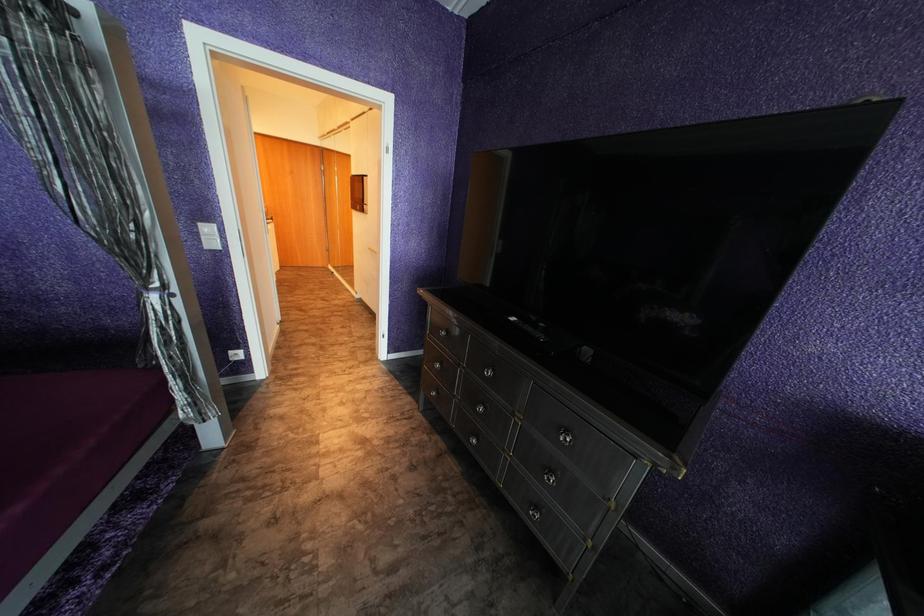
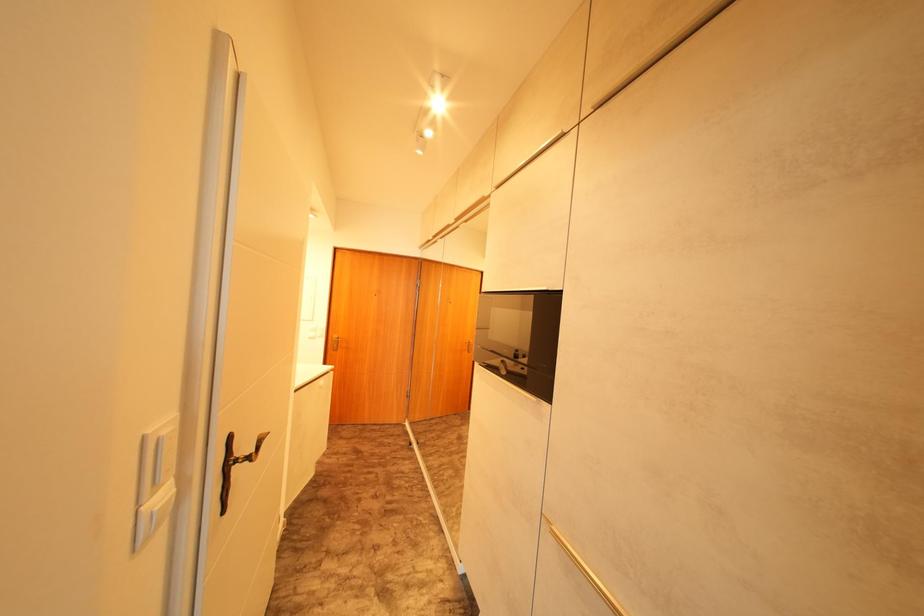
In a continuous first-person perspective shot, in which direction is the camera moving?

The cameraman walked toward left, forward.